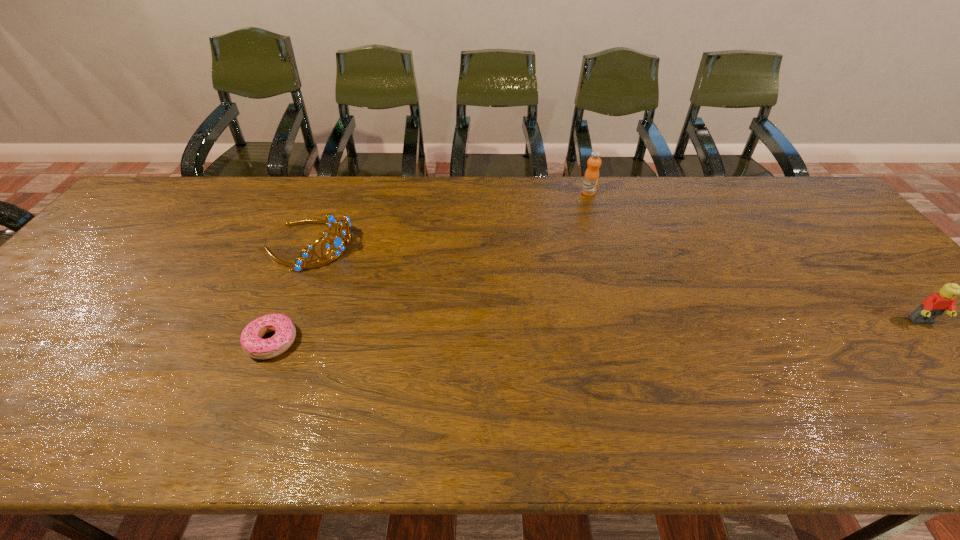
You are a GUI agent. You are given a task and a screenshot of the screen. Output one action in this format:
    pyautogui.click(x=<x>, y=<y>)
    Task: Click on the vacant space on the desktop that is between the shortest object and the third tallest object and is positioned on the front-facing side of the third nearest object
    
    Given the screenshot: What is the action you would take?
    pyautogui.click(x=522, y=334)

This screenshot has height=540, width=960. In order to click on free space on the desktop that is between the shortest object and the second shortest object and is positioned on the front label of the third object from left to right in this screenshot , I will do `click(688, 329)`.